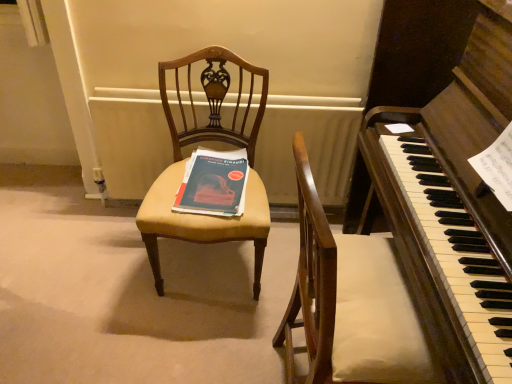
Image resolution: width=512 pixels, height=384 pixels. In order to click on vacant space situated on the left part of matte yellow fabric chair at center in this screenshot , I will do `click(101, 270)`.